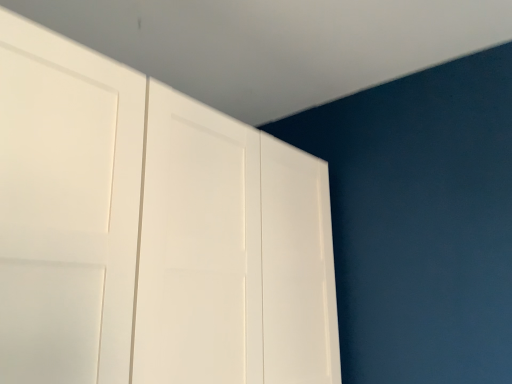
The image size is (512, 384). Describe the element at coordinates (152, 231) in the screenshot. I see `white glossy cupboard at upper left` at that location.

This screenshot has height=384, width=512. Find the location of `white glossy cupboard at upper left`. white glossy cupboard at upper left is located at coordinates (152, 231).

Locate an element on the screen. white glossy cupboard at upper left is located at coordinates (152, 231).